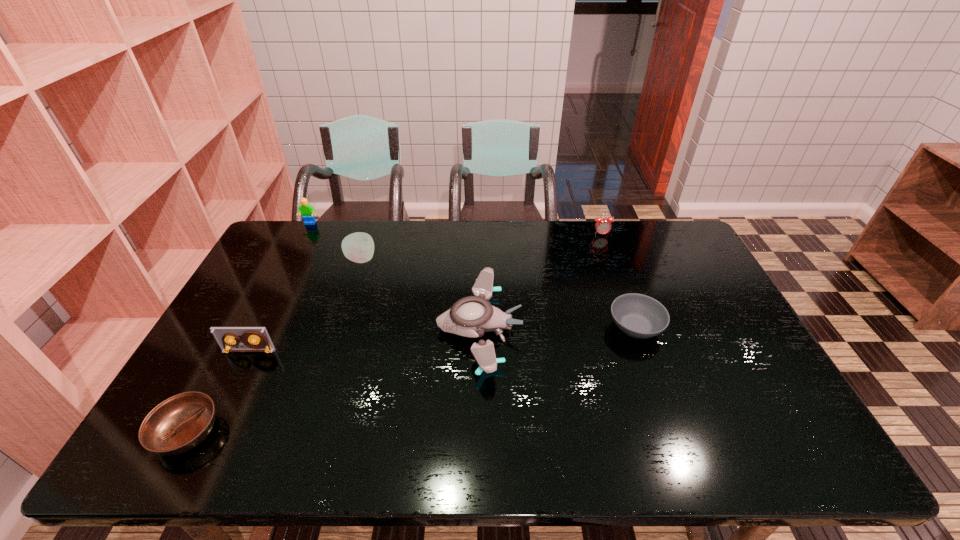
You are a GUI agent. You are given a task and a screenshot of the screen. Output one action in this format:
    pyautogui.click(x=<x>, y=<y>)
    Task: Click on the blank area located on the right of the apple
    
    Given the screenshot: What is the action you would take?
    pyautogui.click(x=466, y=259)

Where is `vacant area situated on the face of the sixth nearest object`? vacant area situated on the face of the sixth nearest object is located at coordinates (611, 260).

Find the location of `free spot located 0.170m at the front of the videotape with visible reels`. free spot located 0.170m at the front of the videotape with visible reels is located at coordinates (220, 408).

Locate an element on the screen. vacant position located 0.190m on the front-facing side of the drone is located at coordinates (587, 328).

Find the location of a particular element. The height and width of the screenshot is (540, 960). vacant space located on the front of the farther soup bowl is located at coordinates (668, 420).

You are a GUI agent. You are given a task and a screenshot of the screen. Output one action in this format:
    pyautogui.click(x=<x>, y=<y>)
    Task: Click on the vacant area located 0.220m on the back of the left soup bowl
    Image resolution: width=960 pixels, height=540 pixels.
    Given the screenshot: What is the action you would take?
    pyautogui.click(x=239, y=336)

Locate an element on the screen. This screenshot has width=960, height=540. Lego at the far edge is located at coordinates (308, 213).

Identify the location of apple positioned at the far edge. (358, 247).

Locate an element on the screen. This screenshot has width=960, height=540. alarm clock present at the far edge is located at coordinates (602, 225).

Identify the location of object present at the near edge. (178, 424).